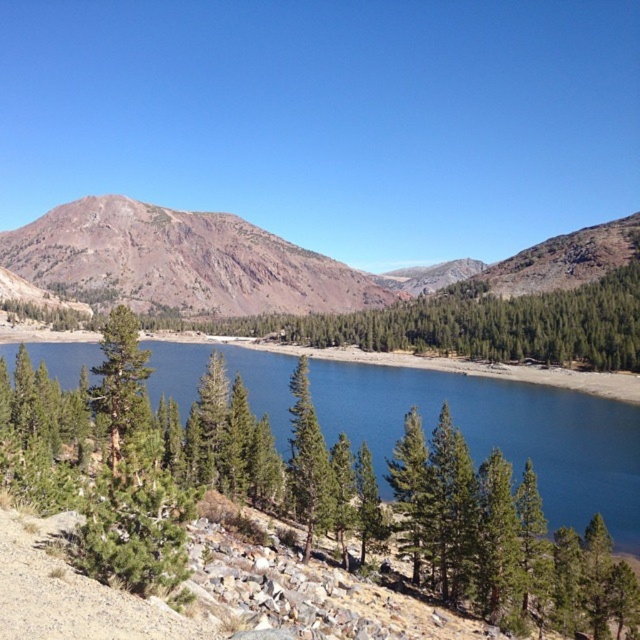
Which is below, brown rocky mountain at upper left or green matte tree at left?

Positioned lower is green matte tree at left.

Does brown rocky mountain at upper left have a smaller size compared to green matte tree at left?

Actually, brown rocky mountain at upper left might be larger than green matte tree at left.

Where is `brown rocky mountain at upper left`? The height and width of the screenshot is (640, 640). brown rocky mountain at upper left is located at coordinates (180, 262).

Which is above, blue glassy water at center or green textured tree at center?

green textured tree at center is above.

Which of these two, blue glassy water at center or green textured tree at center, stands shorter?

blue glassy water at center is shorter.

Locate an element on the screen. blue glassy water at center is located at coordinates (499, 433).

Can you confirm if brown rocky mountain at upper left is positioned above green textured tree at center?

Correct, brown rocky mountain at upper left is located above green textured tree at center.

Who is more distant from viewer, (70, 276) or (630, 268)?

The point (70, 276) is behind.

The width and height of the screenshot is (640, 640). What do you see at coordinates (180, 262) in the screenshot?
I see `brown rocky mountain at upper left` at bounding box center [180, 262].

Image resolution: width=640 pixels, height=640 pixels. What are the coordinates of `brown rocky mountain at upper left` in the screenshot? It's located at (180, 262).